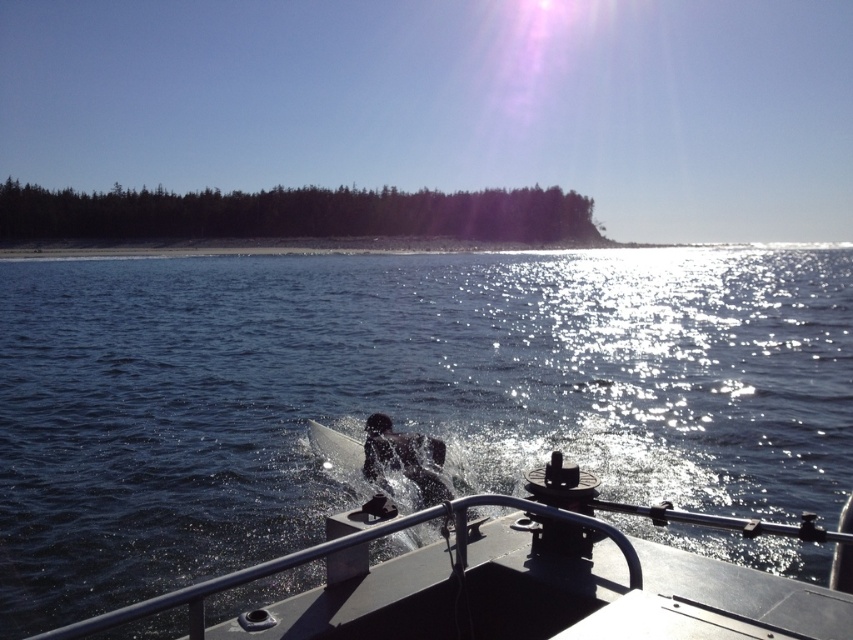
You are standing on the deck of the boat and want to know which object is wider. Based on the scene, which one is wider between the dark blue water at center and the metallic gray boat at center?

The dark blue water at center is wider than the metallic gray boat at center according to the description.

You are standing on the boat deck and want to look at the dark blue water at center and the metallic gray boat at center. Which one is located to the left when facing the scene?

The dark blue water at center is to the left of the metallic gray boat at center.